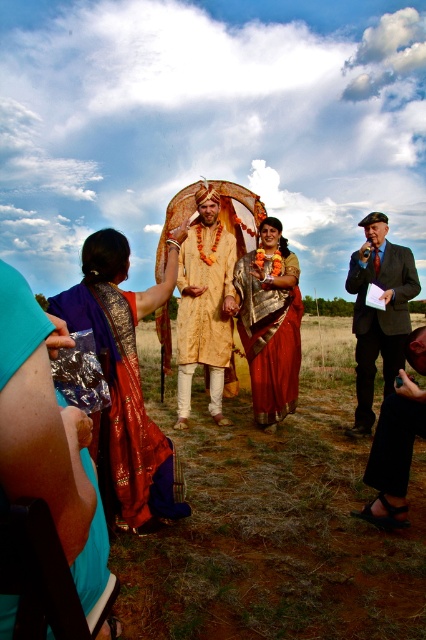
Based on the photo, in the wedding scene, there is a silky purple sari at left and black leather sandals at lower right. Which object is positioned higher in the image?

The silky purple sari at left is taller than the black leather sandals at lower right, so the silky purple sari at left is positioned higher in the image.

You are attending a traditional Indian wedding and see the silky purple sari at left. Can you determine its exact location in the image using coordinates?

The silky purple sari at left is located at coordinates point (123, 410).